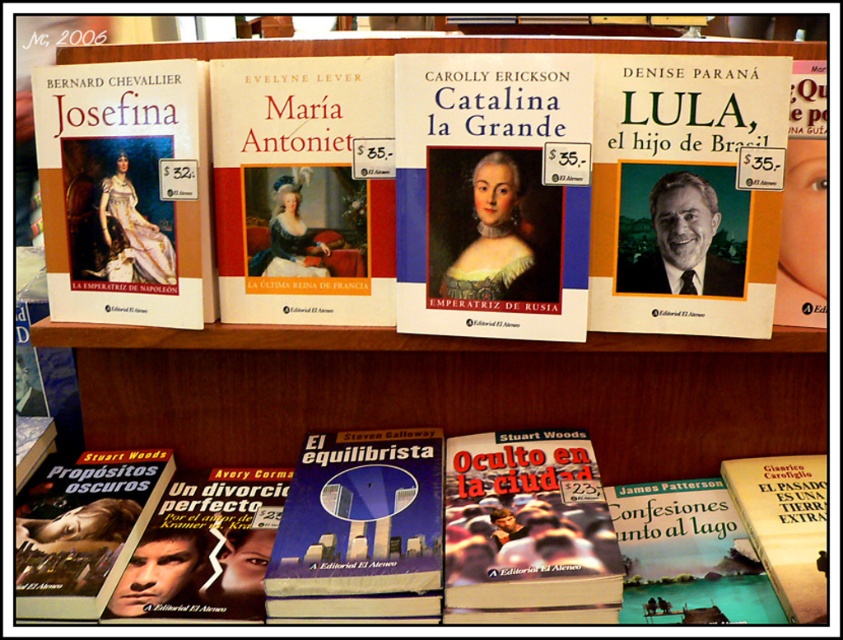
You are organizing a display for a library and need to ensure that the matte gold book at upper left and the blue hardcover book at center are placed in order of their height. According to the description, which book should be placed first if you want to arrange them from tallest to shortest?

The matte gold book at upper left is taller than the blue hardcover book at center, so it should be placed first when arranging from tallest to shortest.

Looking at this image, you are organizing books on a shelf and need to place a new book between the matte white book at upper left and the blue hardcover book at center. Can you fit it there?

The matte white book at upper left is to the left of the blue hardcover book at center, so there is space between them to fit a new book.

You are organizing a library shelf and need to place both the matte gold book at upper left and the blue hardcover book at center. Since the shelf has limited space, which book should you place first to ensure both fit properly?

The matte gold book at upper left has a smaller size compared to the blue hardcover book at center, so you should place the smaller matte gold book at upper left first to accommodate both on the shelf.